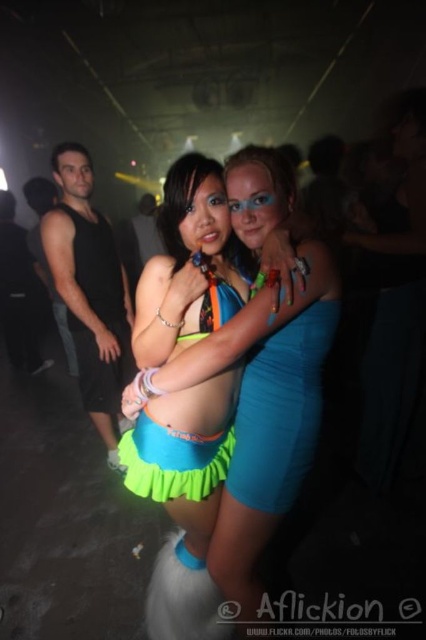
You are standing at the entrance of the party and want to greet both people at point (333, 284) and point (210, 291). Which person should you approach first to reach the one further away last?

You should approach the person at point (210, 291) first because point (333, 284) is in front of it, meaning the person at point (210, 291) is further away and should be visited last.

You are at a party and want to locate the neon green fabric skirt at center. According to the coordinates provided, where exactly is it positioned?

The neon green fabric skirt at center is located at point (x=259, y=374).